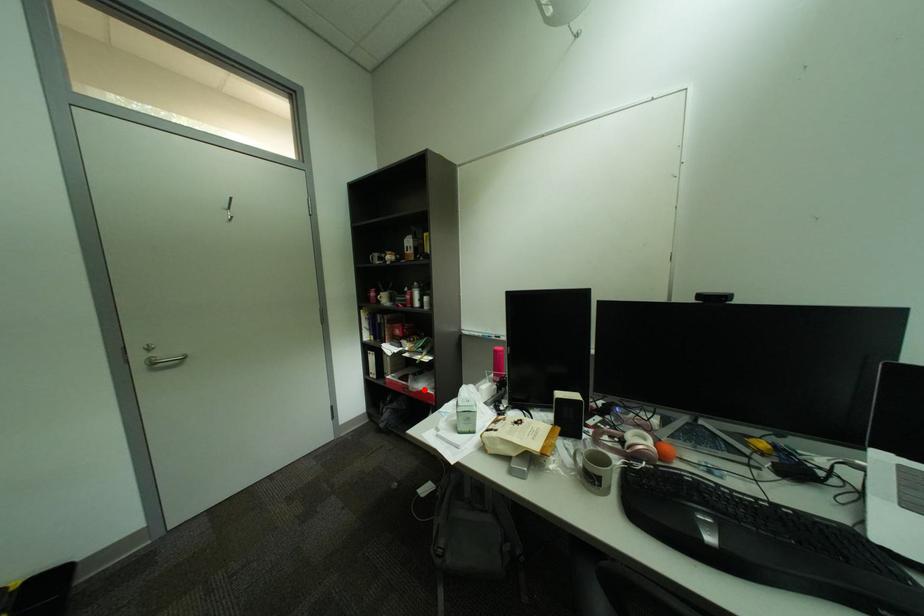
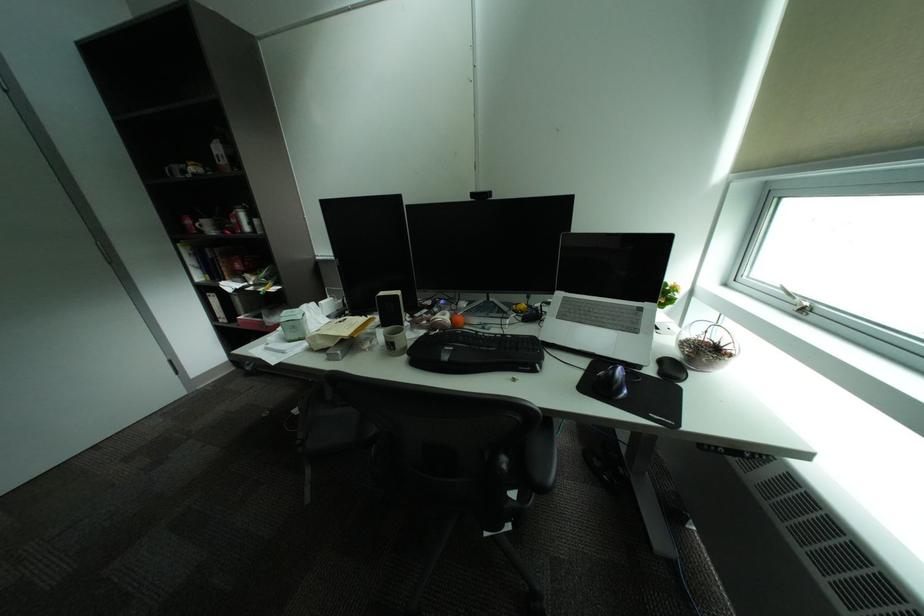
Find the pixel in the second image that matches the highlighted location in the first image.

(281, 323)